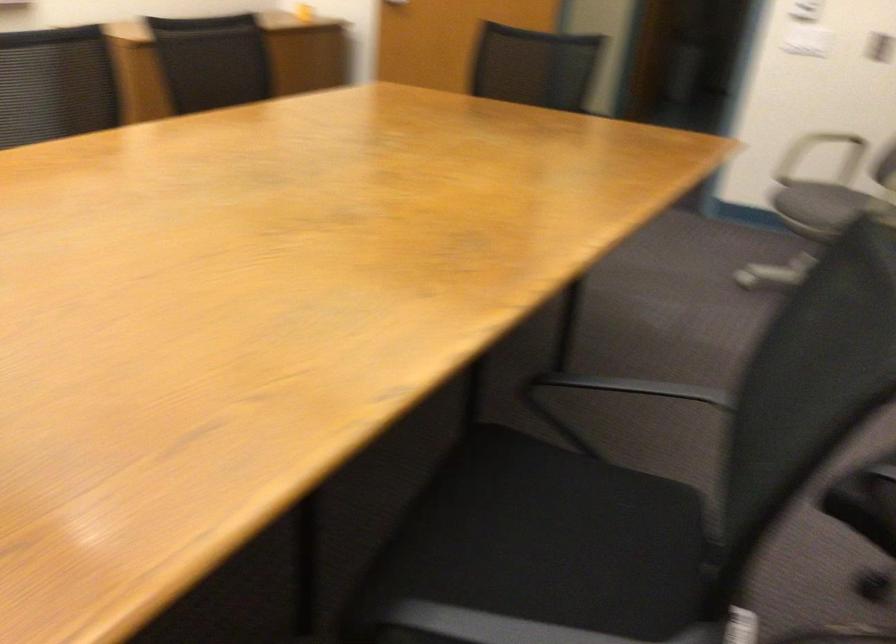
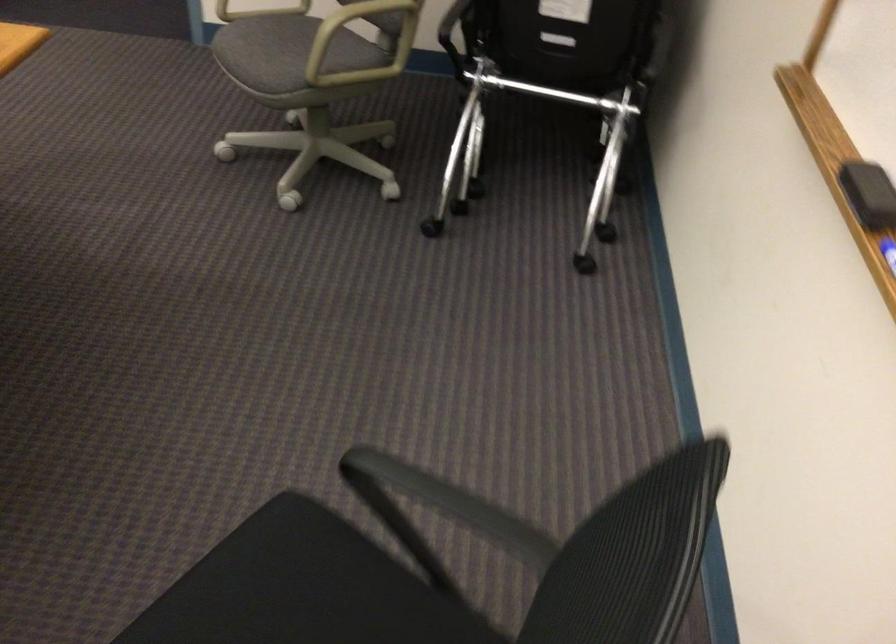
Consider the image. In a continuous first-person perspective shot, in which direction is the camera moving?

The movement direction of the cameraman is right, forward.